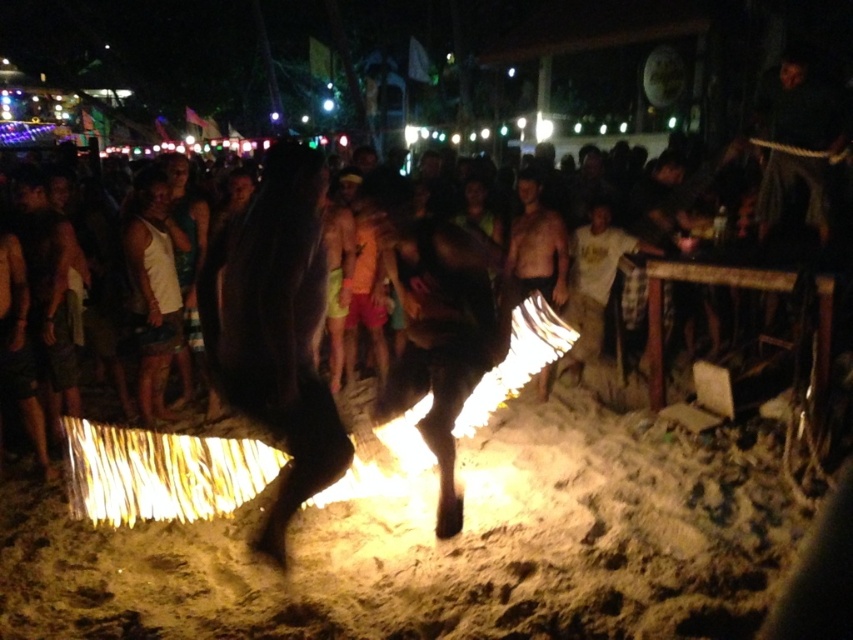
You are a photographer trying to capture the fire dance performance. You notice the white cotton shirt at center and the shiny black skin at center. Which object should you focus on if you want to highlight the contrast between light and dark elements in your photo?

The white cotton shirt at center is positioned on the right side of shiny black skin at center. To highlight the contrast between light and dark elements, focus on both the white cotton shirt at center and the shiny black skin at center as they are positioned next to each other, creating a natural contrast in the image.